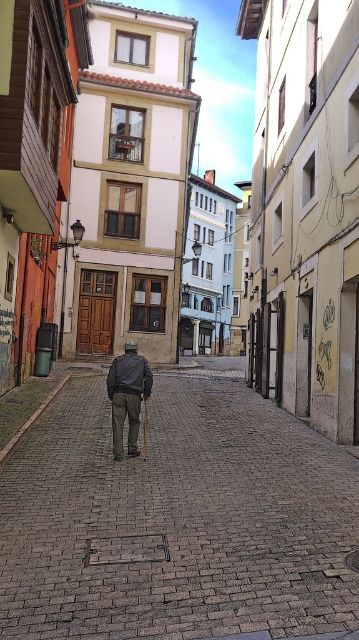
Does brown brick pavement at center appear on the left side of dark gray fabric jacket at center?

In fact, brown brick pavement at center is to the right of dark gray fabric jacket at center.

Which is behind, point (302, 468) or point (128, 410)?

Positioned behind is point (128, 410).

You are a GUI agent. You are given a task and a screenshot of the screen. Output one action in this format:
    pyautogui.click(x=<x>, y=<y>)
    Task: Click on the brown brick pavement at center
    The width and height of the screenshot is (359, 640).
    Given the screenshot: What is the action you would take?
    point(175,516)